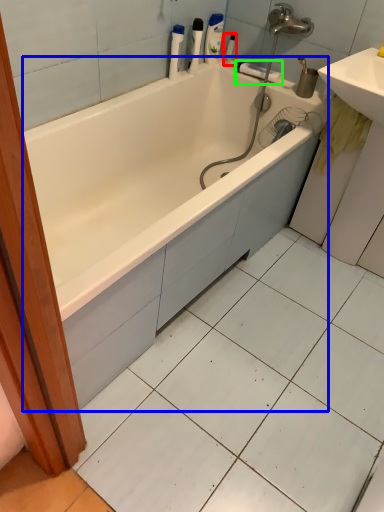
Question: Estimate the real-world distances between objects in this image. Which object is farther from toiletry (highlighted by a red box), bathtub (highlighted by a blue box) or towel bar (highlighted by a green box)?

Choices:
 (A) bathtub
 (B) towel bar

Answer: (A)